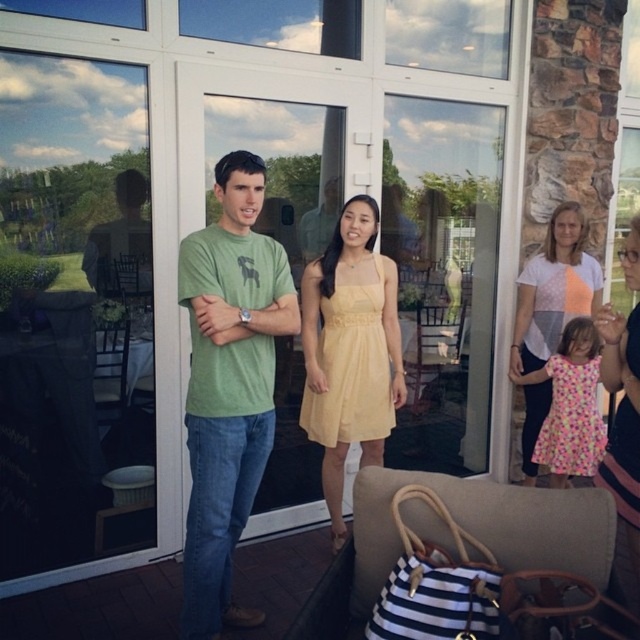
You are a photographer trying to capture both the yellow satin dress at center and the floral cotton dress at lower right in the same frame. Which dress should you focus on first to ensure both are in focus?

You should focus on the yellow satin dress at center first because it is closer to the viewer than the floral cotton dress at lower right. By focusing on the closer object, the depth of field may allow the background object to remain in acceptable focus.